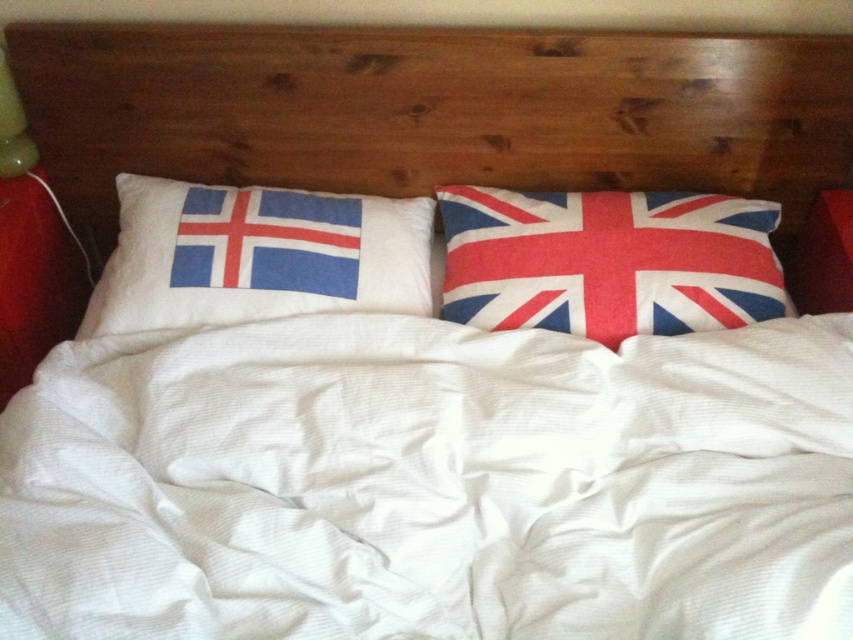
Question: Estimate the real-world distances between objects in this image. Which object is closer to the textured cotton pillow with union jack design at right?

Choices:
 (A) white textured sheet at center
 (B) white cotton pillow with flag design at left

Answer: (A)

Question: Which point is closer to the camera?

Choices:
 (A) white cotton pillow with flag design at left
 (B) wooden headboard at center
 (C) white textured sheet at center
 (D) textured cotton pillow with union jack design at right

Answer: (C)

Question: Observing the image, what is the correct spatial positioning of white textured sheet at center in reference to white cotton pillow with flag design at left?

Choices:
 (A) above
 (B) below

Answer: (B)

Question: Is white textured sheet at center behind textured cotton pillow with union jack design at right?

Choices:
 (A) no
 (B) yes

Answer: (A)

Question: Observing the image, what is the correct spatial positioning of wooden headboard at center in reference to white cotton pillow with flag design at left?

Choices:
 (A) left
 (B) right

Answer: (B)

Question: Which object is closer to the camera taking this photo?

Choices:
 (A) textured cotton pillow with union jack design at right
 (B) white cotton pillow with flag design at left
 (C) white textured sheet at center

Answer: (C)